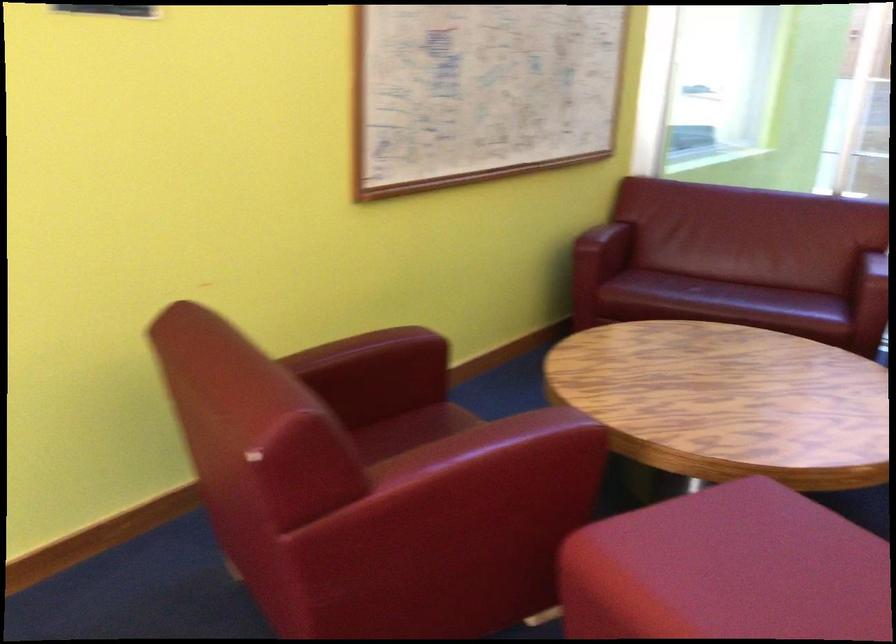
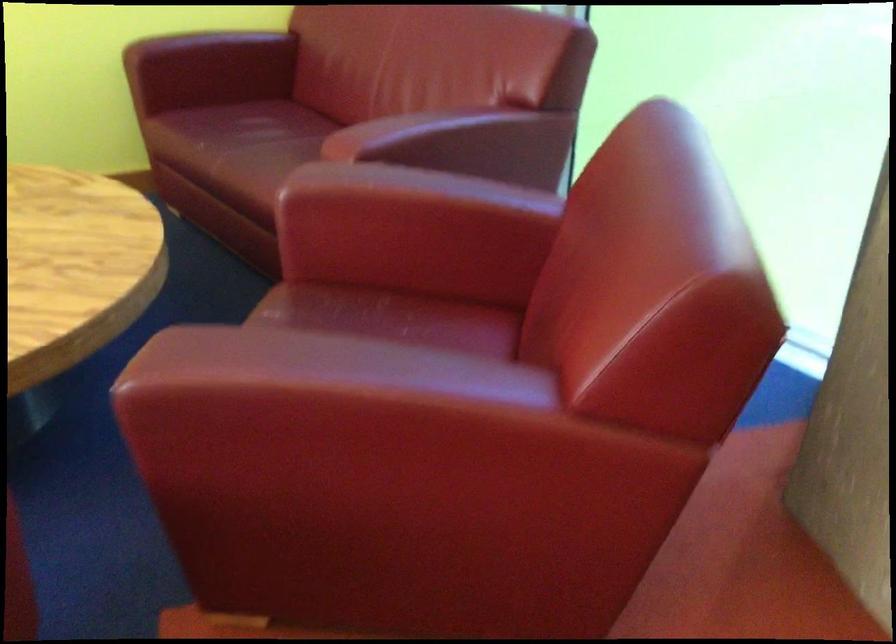
Question: I am providing you with two images of the same scene from different viewpoints. Which of the following objects are not visible in image2?

Choices:
 (A) red chair sitting surface
 (B) sofa armrest
 (C) white book
 (D) red chair armrest

Answer: (B)